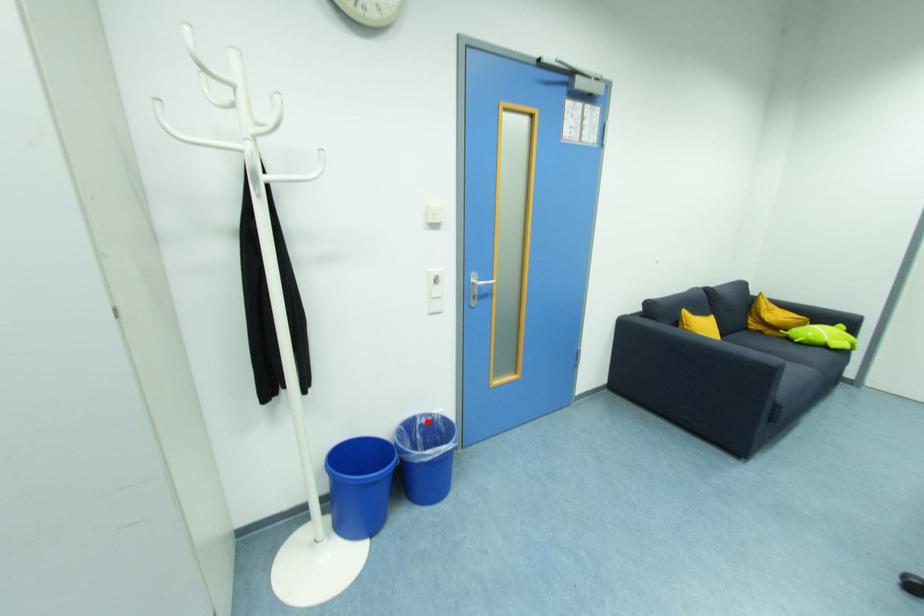
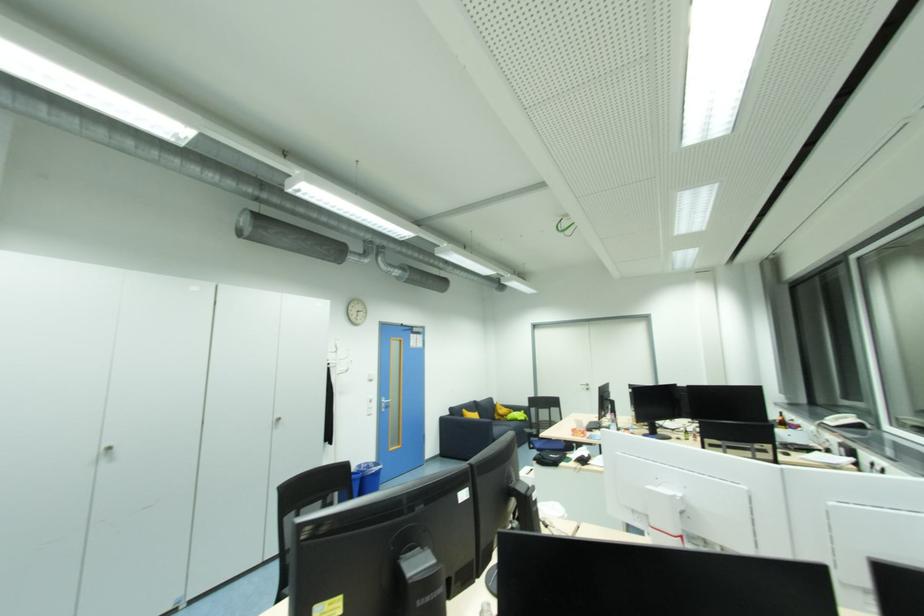
Question: I am providing you with two images of the same scene from different viewpoints. Image1 has a red point marked. In image2, the corresponding 3D location appears at what relative position? Reply with the corresponding letter.

Choices:
 (A) Closer
 (B) Farther

Answer: (B)